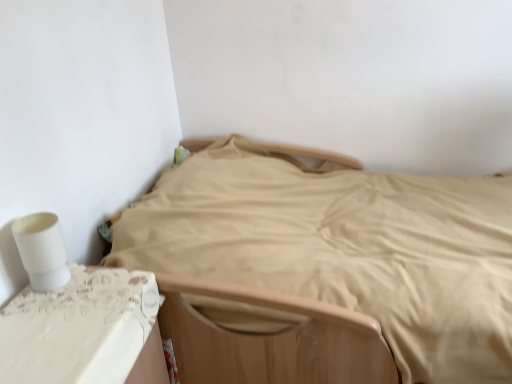
Question: In the image, is white lace table at lower left on the left side or the right side of beige fabric bed at center?

Choices:
 (A) left
 (B) right

Answer: (A)

Question: Considering the positions of point (105, 331) and point (139, 238), is point (105, 331) closer or farther from the camera than point (139, 238)?

Choices:
 (A) farther
 (B) closer

Answer: (B)

Question: Considering the real-world distances, which object is closest to the white matte toilet paper at left?

Choices:
 (A) beige fabric bed at center
 (B) white lace table at lower left

Answer: (B)

Question: Considering the real-world distances, which object is farthest from the white matte toilet paper at left?

Choices:
 (A) white lace table at lower left
 (B) beige fabric bed at center

Answer: (B)